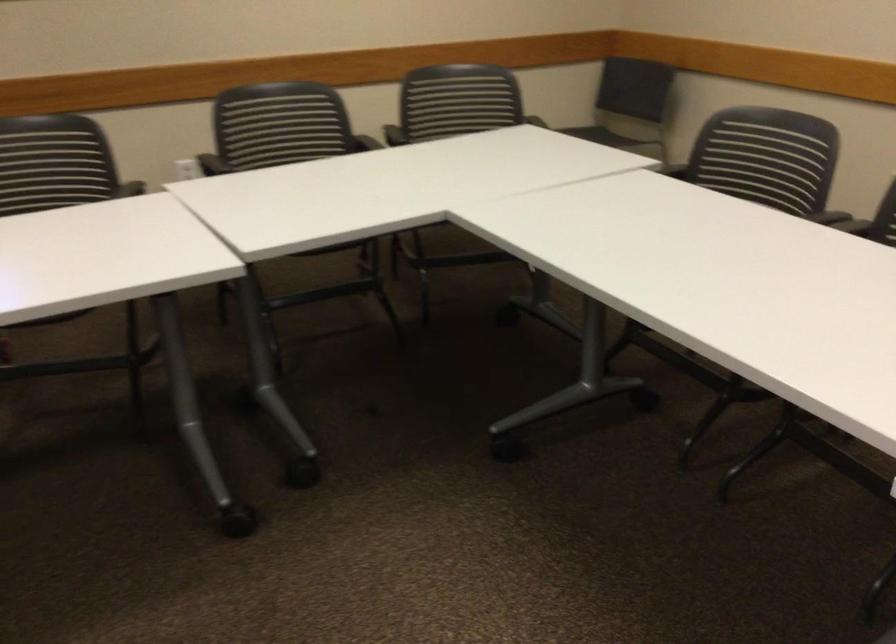
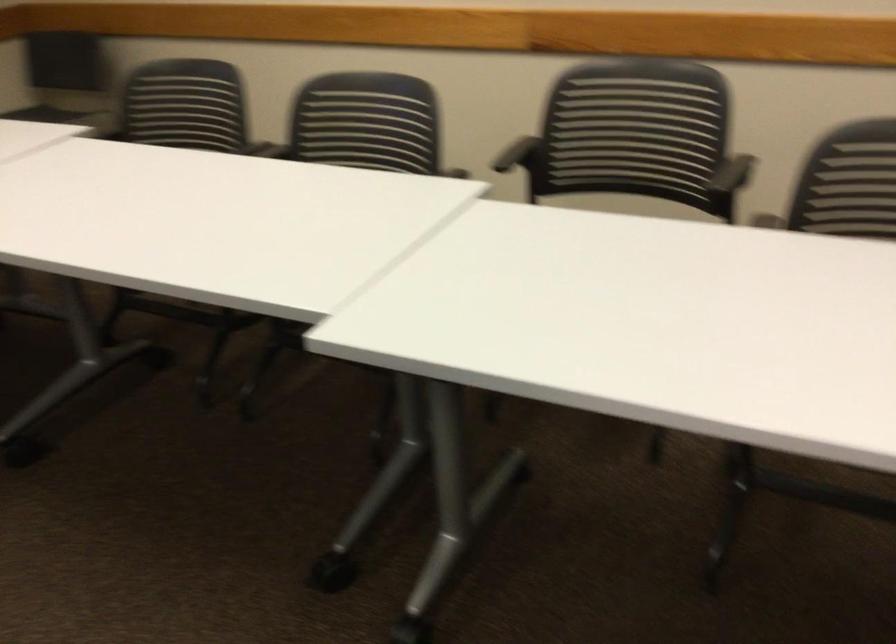
Question: The camera is either moving clockwise (left) or counter-clockwise (right) around the object. The first image is from the beginning of the video and the second image is from the end. Is the camera moving left or right when shooting the video?

Choices:
 (A) Left
 (B) Right

Answer: (A)